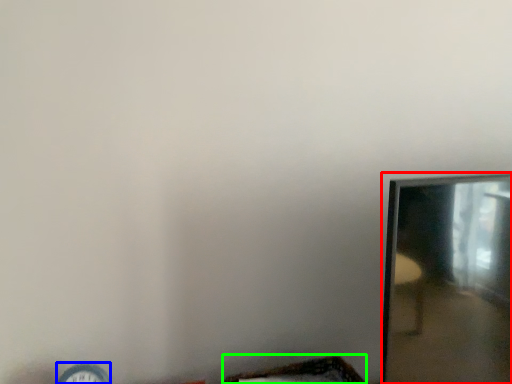
Question: Which is nearer to the mirror (highlighted by a red box)? clock (highlighted by a blue box) or basket (highlighted by a green box).

Choices:
 (A) clock
 (B) basket

Answer: (B)